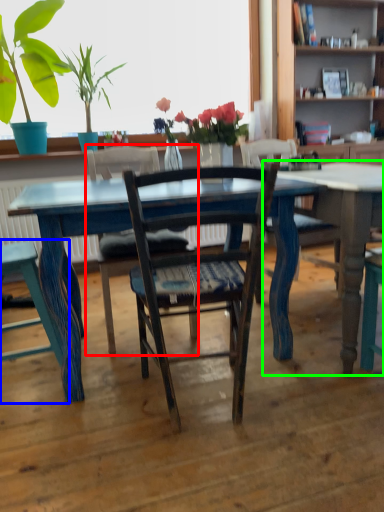
Question: Which is nearer to the chair (highlighted by a red box)? chair (highlighted by a blue box) or table (highlighted by a green box).

Choices:
 (A) chair
 (B) table

Answer: (A)